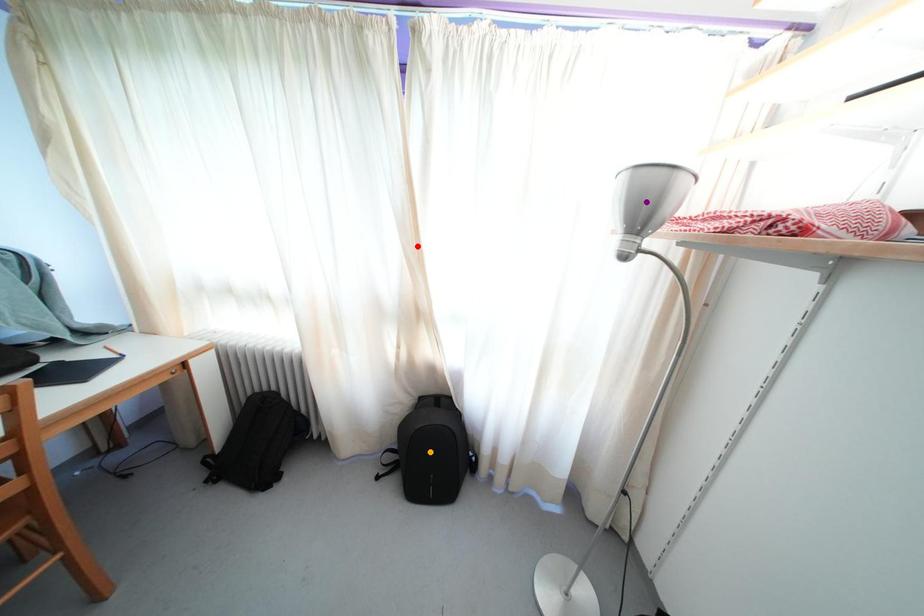
Order these from nearest to farthest:
- red point
- orange point
- purple point

1. purple point
2. red point
3. orange point